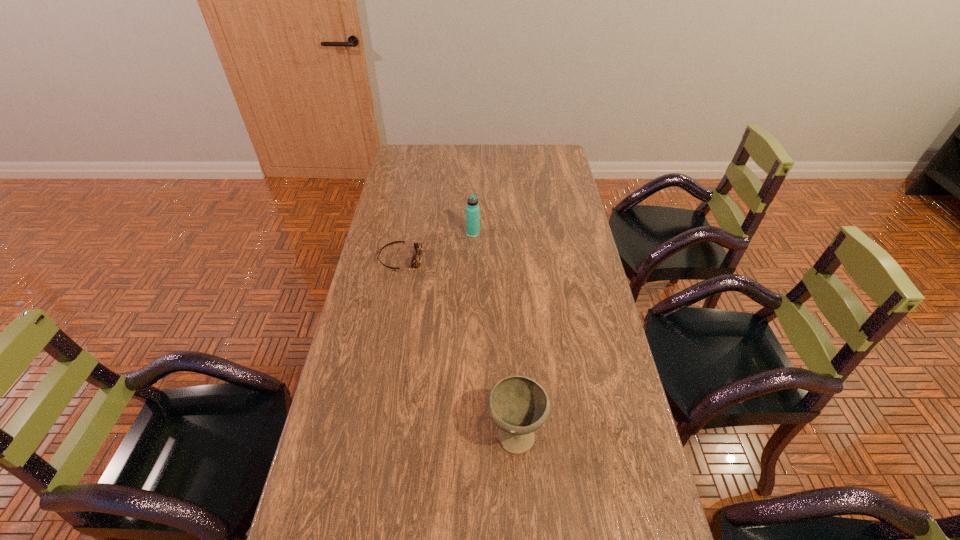
Find the location of a particular element. This screenshot has width=960, height=540. blank space at the far edge of the desktop is located at coordinates (442, 166).

Where is `vacant region at the left edge of the desktop`? The width and height of the screenshot is (960, 540). vacant region at the left edge of the desktop is located at coordinates (405, 226).

Locate an element on the screen. The height and width of the screenshot is (540, 960). free space at the right edge of the desktop is located at coordinates (612, 377).

What are the coordinates of `vacant region at the far left corner` in the screenshot? It's located at (423, 153).

In the image, there is a desktop. Where is `vacant area at the far right corner`? vacant area at the far right corner is located at coordinates (557, 168).

Identify the location of unoccupied area between the nearest object and the goggles. Image resolution: width=960 pixels, height=540 pixels. (458, 346).

Identify the location of vacant space that is in between the second farthest object and the thermos bottle. The width and height of the screenshot is (960, 540). (437, 247).

This screenshot has width=960, height=540. I want to click on free space between the second farthest object and the chalice, so click(458, 346).

Locate an element on the screen. This screenshot has width=960, height=540. empty space that is in between the chalice and the shortest object is located at coordinates (458, 346).

You are a GUI agent. You are given a task and a screenshot of the screen. Output one action in this format:
    pyautogui.click(x=<x>, y=<y>)
    Task: Click on the unoccupied area between the chalice and the shortest object
    The height and width of the screenshot is (540, 960).
    Given the screenshot: What is the action you would take?
    pyautogui.click(x=458, y=346)